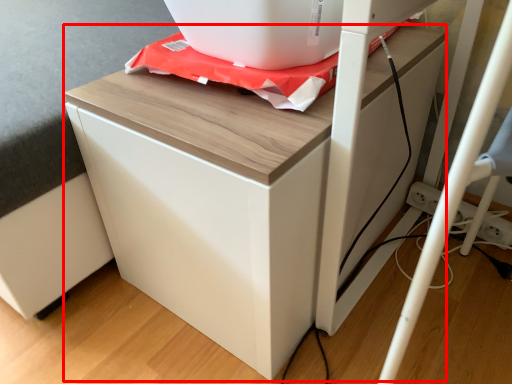
Question: From the image's perspective, where is furniture (annotated by the red box) located in relation to appliance in the image?

Choices:
 (A) above
 (B) below

Answer: (B)